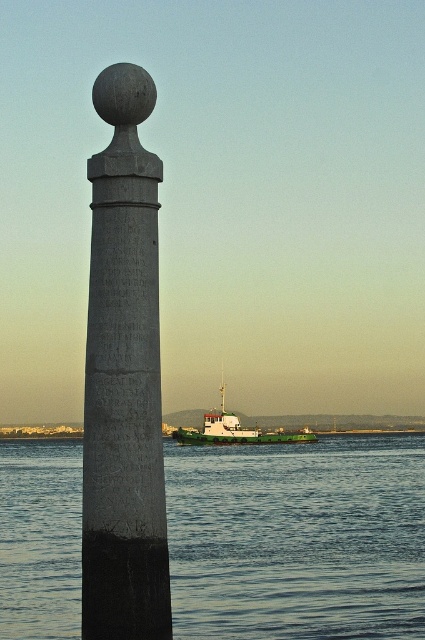
Question: Which point is farther to the camera?

Choices:
 (A) (183, 429)
 (B) (235, 484)
 (C) (138, 484)

Answer: (A)

Question: Does gray stone column at left lie in front of green matte boat at lower center?

Choices:
 (A) yes
 (B) no

Answer: (A)

Question: Does blue water at lower center have a larger size compared to green matte boat at lower center?

Choices:
 (A) yes
 (B) no

Answer: (A)

Question: From the image, what is the correct spatial relationship of blue water at lower center in relation to green matte boat at lower center?

Choices:
 (A) right
 (B) left

Answer: (B)

Question: Which point is farther to the camera?

Choices:
 (A) gray stone column at left
 (B) green matte boat at lower center

Answer: (B)

Question: Which object is the closest to the gray stone column at left?

Choices:
 (A) blue water at lower center
 (B) green matte boat at lower center

Answer: (A)